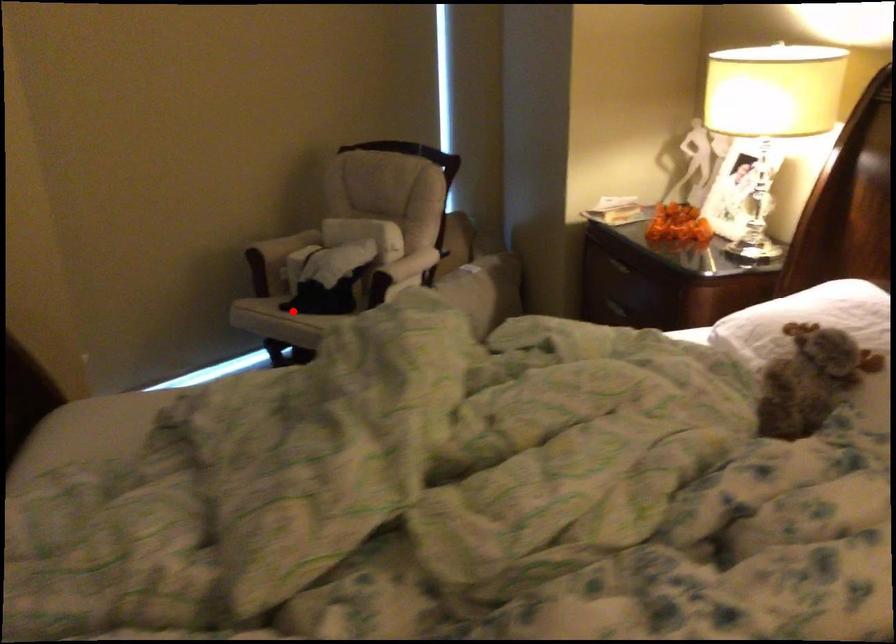
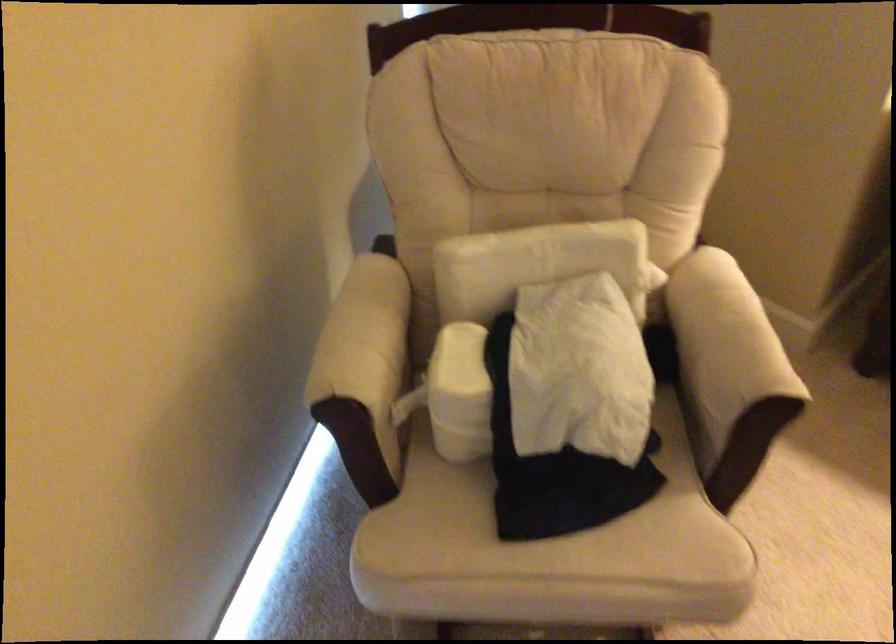
Where in the second image is the point corresponding to the highlighted location from the first image?

(545, 535)